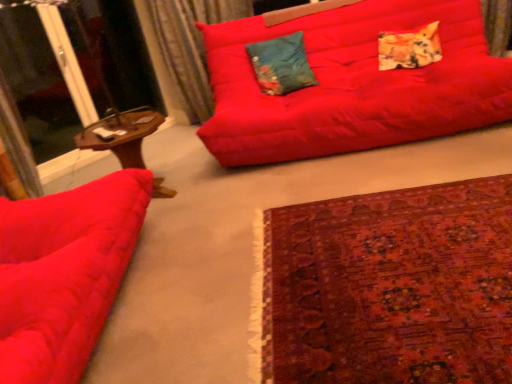
Question: From a real-world perspective, is teal floral cushion at center, which is the 2th pillow from right to left, on top of textured orange-yellow pillow at upper right, arranged as the first pillow when viewed from the right?

Choices:
 (A) no
 (B) yes

Answer: (B)

Question: From the image's perspective, would you say teal floral cushion at center, which is the 2th pillow from right to left, is positioned over textured orange-yellow pillow at upper right, which is the 2th pillow in left-to-right order?

Choices:
 (A) no
 (B) yes

Answer: (A)

Question: Is teal floral cushion at center, the first pillow in the left-to-right sequence, smaller than textured orange-yellow pillow at upper right, which is the 2th pillow in left-to-right order?

Choices:
 (A) yes
 (B) no

Answer: (B)

Question: Is teal floral cushion at center, the first pillow in the left-to-right sequence, at the right side of textured orange-yellow pillow at upper right, arranged as the first pillow when viewed from the right?

Choices:
 (A) yes
 (B) no

Answer: (B)

Question: Does teal floral cushion at center, the first pillow in the left-to-right sequence, appear on the left side of textured orange-yellow pillow at upper right, arranged as the first pillow when viewed from the right?

Choices:
 (A) no
 (B) yes

Answer: (B)

Question: Can you confirm if teal floral cushion at center, which is the 2th pillow from right to left, is bigger than textured orange-yellow pillow at upper right, arranged as the first pillow when viewed from the right?

Choices:
 (A) yes
 (B) no

Answer: (A)

Question: Is transparent glass screen door at upper left further to camera compared to textured orange-yellow pillow at upper right, which is the 2th pillow in left-to-right order?

Choices:
 (A) no
 (B) yes

Answer: (A)

Question: Is transparent glass screen door at upper left thinner than textured orange-yellow pillow at upper right, which is the 2th pillow in left-to-right order?

Choices:
 (A) no
 (B) yes

Answer: (B)

Question: Is transparent glass screen door at upper left turned away from textured orange-yellow pillow at upper right, arranged as the first pillow when viewed from the right?

Choices:
 (A) no
 (B) yes

Answer: (A)

Question: Does transparent glass screen door at upper left have a larger size compared to textured orange-yellow pillow at upper right, which is the 2th pillow in left-to-right order?

Choices:
 (A) no
 (B) yes

Answer: (B)

Question: Is transparent glass screen door at upper left facing towards textured orange-yellow pillow at upper right, which is the 2th pillow in left-to-right order?

Choices:
 (A) yes
 (B) no

Answer: (A)

Question: Would you say transparent glass screen door at upper left is outside textured orange-yellow pillow at upper right, arranged as the first pillow when viewed from the right?

Choices:
 (A) no
 (B) yes

Answer: (B)

Question: From a real-world perspective, is velvet curtain at upper left positioned over matte red studio couch at left, positioned as the second studio couch in right-to-left order, based on gravity?

Choices:
 (A) no
 (B) yes

Answer: (B)